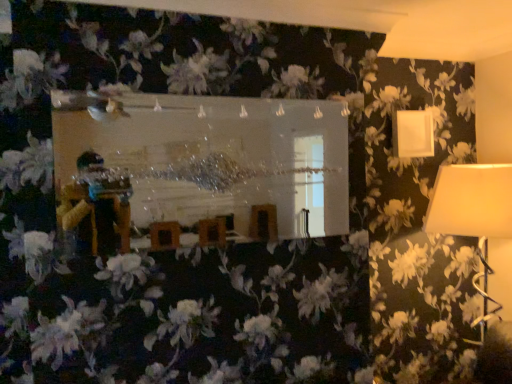
Question: Considering the relative positions of clear glass mirror at center and white fabric lampshade at right, positioned as the first lamp in bottom-to-top order, in the image provided, is clear glass mirror at center to the left or to the right of white fabric lampshade at right, positioned as the first lamp in bottom-to-top order,?

Choices:
 (A) left
 (B) right

Answer: (A)

Question: From a real-world perspective, is clear glass mirror at center physically located above or below white fabric lampshade at right, the second lamp in the top-to-bottom sequence?

Choices:
 (A) above
 (B) below

Answer: (A)

Question: Estimate the real-world distances between objects in this image. Which object is farther from the white matte lampshade at upper right, acting as the 2th lamp starting from the bottom?

Choices:
 (A) clear glass mirror at center
 (B) white fabric lampshade at right, the second lamp in the top-to-bottom sequence

Answer: (A)

Question: Which object is positioned closest to the white fabric lampshade at right, positioned as the first lamp in bottom-to-top order?

Choices:
 (A) clear glass mirror at center
 (B) white matte lampshade at upper right, which is counted as the 1th lamp, starting from the top

Answer: (B)